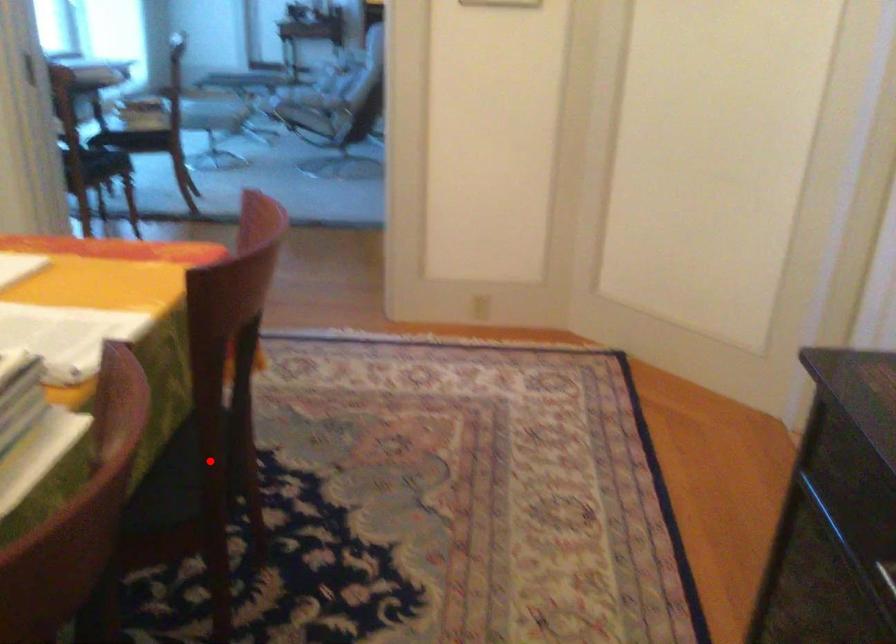
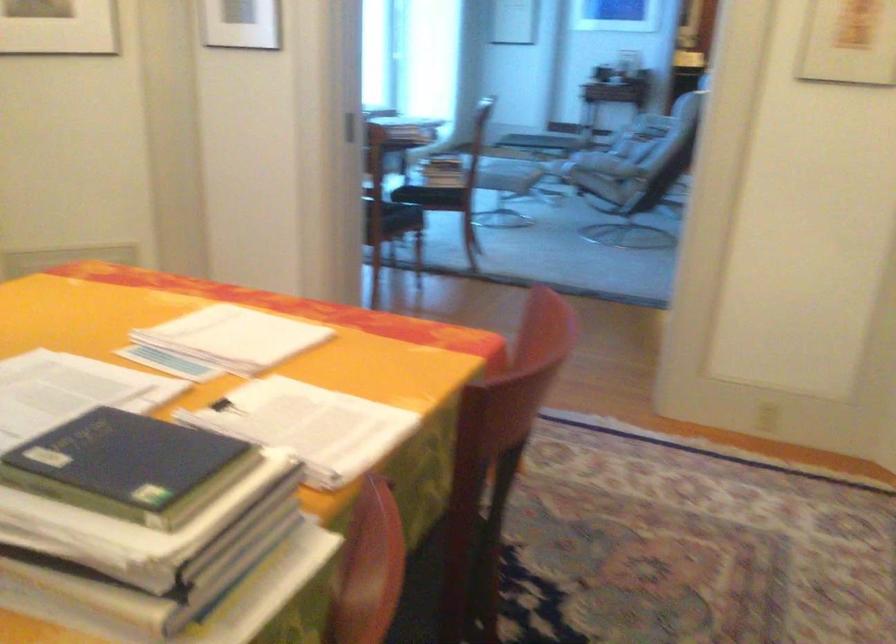
In the second image, find the point that corresponds to the highlighted location in the first image.

(452, 585)